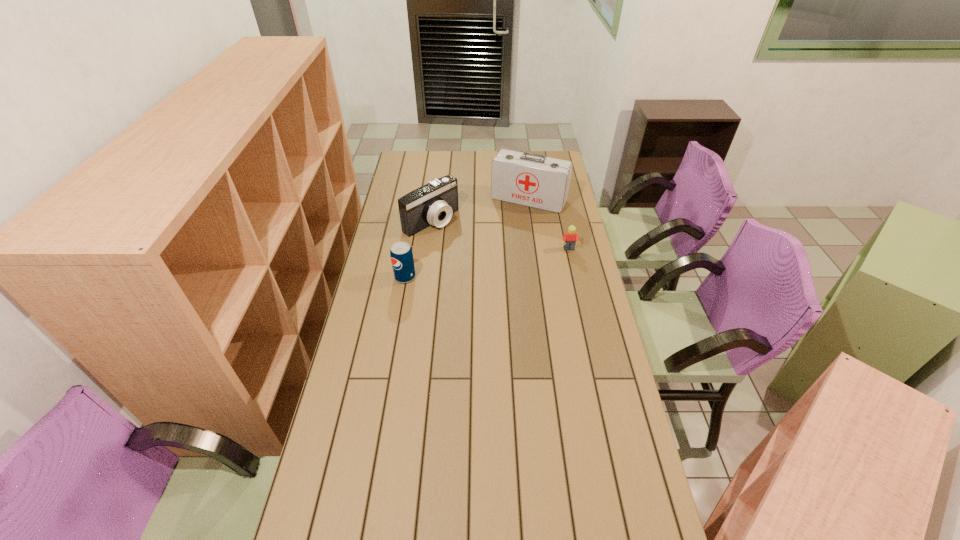
What are the coordinates of `vacant region located on the lens of the second tallest object` in the screenshot? It's located at (477, 252).

Locate an element on the screen. This screenshot has height=540, width=960. vacant position located on the front-facing side of the first-aid kit is located at coordinates (510, 225).

Locate an element on the screen. The image size is (960, 540). free space located 0.320m on the front-facing side of the first-aid kit is located at coordinates (493, 254).

Where is `vacant space located 0.110m on the front-facing side of the first-aid kit`? vacant space located 0.110m on the front-facing side of the first-aid kit is located at coordinates (510, 226).

Identify the location of pop that is at the left edge. This screenshot has height=540, width=960. (401, 254).

Find the location of a particular element. camcorder that is at the left edge is located at coordinates (434, 203).

This screenshot has width=960, height=540. Find the location of `Lego that is at the right edge`. Lego that is at the right edge is located at coordinates (570, 238).

At what (x,y) coordinates should I click in order to perform the action: click on the first-aid kit present at the right edge. Please return your answer as a coordinate pair (x, y). This screenshot has width=960, height=540. Looking at the image, I should click on (529, 179).

Find the location of a particular element. The image size is (960, 540). vacant region at the far edge is located at coordinates (468, 160).

At what (x,y) coordinates should I click in order to perform the action: click on free space at the left edge of the desktop. Please return your answer as a coordinate pair (x, y). Image resolution: width=960 pixels, height=540 pixels. Looking at the image, I should click on (355, 363).